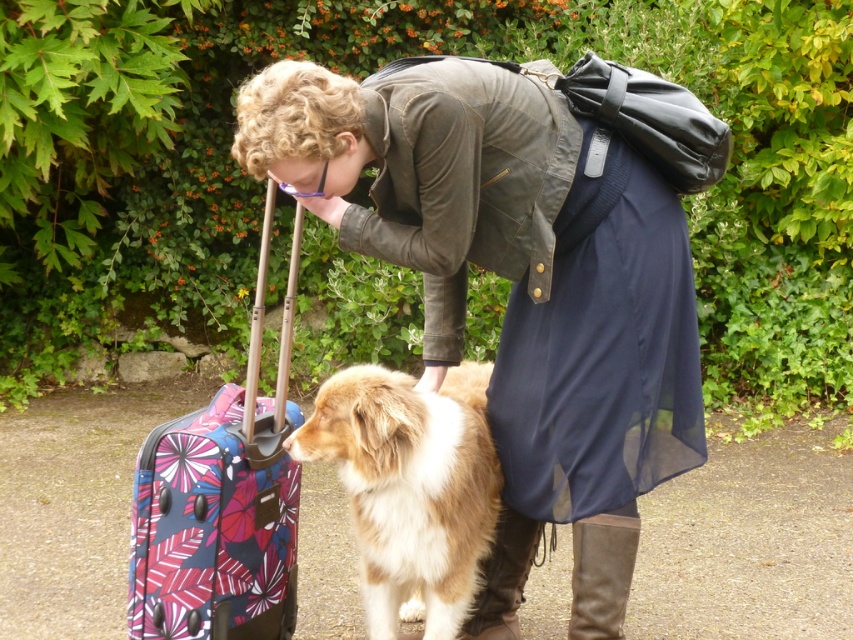
You are standing in the scene and want to pick up the brown leather boot at lower center. Which object, the brown fluffy dog at center or the boot, would you need to step over first?

The brown fluffy dog at center is closer to the viewer than the brown leather boot at lower center, so you would need to step over the brown fluffy dog at center first before reaching the boot.

You are standing in front of the suitcase and want to pick up the brown suede boot at lower center. Is the brown fluffy dog at center blocking your path to the boot?

The brown fluffy dog at center is closer to the viewer than the brown suede boot at lower center, so the dog is blocking the path to the boot.

You are a photographer setting up a shot of the scene described. To ensure the matte olive green jacket at center and the brown suede boot at lower center are both clearly visible, which object should you adjust to be closer to the camera?

The matte olive green jacket at center is in front of the brown suede boot at lower center, so the brown suede boot at lower center should be moved closer to the camera to ensure both are visible.